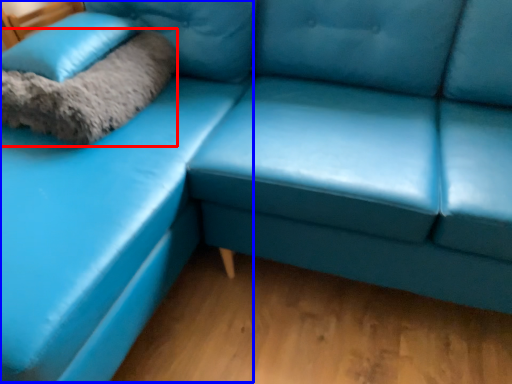
Question: Which object is closer to the camera taking this photo, blanket (highlighted by a red box) or couch (highlighted by a blue box)?

Choices:
 (A) blanket
 (B) couch

Answer: (B)